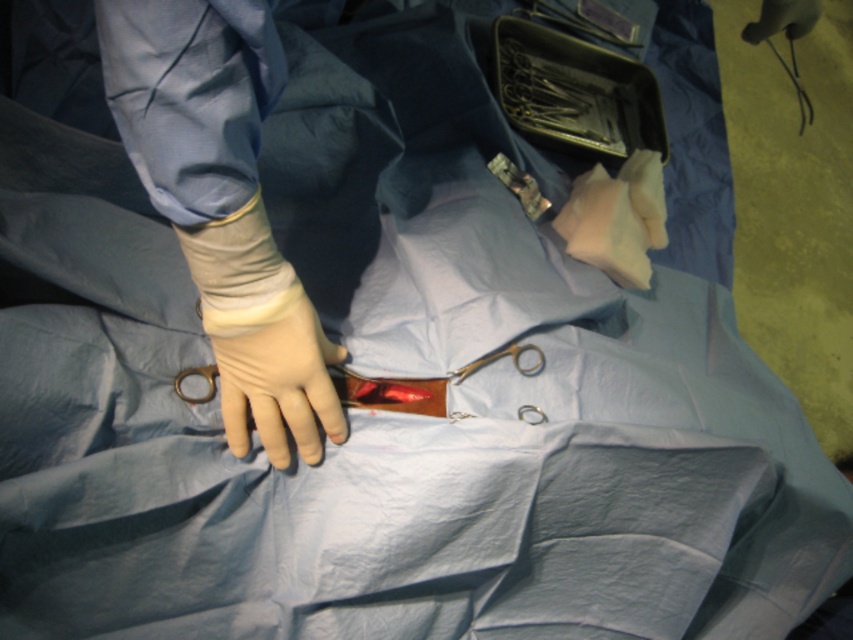
You are a medical student observing a surgery. The surgical instruments are placed at the point with coordinates (575,93). If you need to locate the instruments quickly during the procedure, which direction should you look relative to the central incision?

The point (575,93) corresponds to the metallic silver surgical instruments at upper right, so you should look towards the upper right direction relative to the central incision to locate them.

From the picture: You are a surgical assistant needing to reach the metallic silver surgical instruments at upper right from your current position near the beige rubber glove at left. Can you comfortably stretch your arm to reach them without moving your torso? Please consider the distance provided in the scene.

The distance between the beige rubber glove at left and the metallic silver surgical instruments at upper right is 75.72 centimeters. Given that the average human arm length is around 70 centimeters, stretching might be required, but it could be possible depending on individual flexibility. However, in a surgical setting, reaching such a distance without moving the torso might be challenging and not advisable for precision. It is recommended to adjust positioning or ask for assistance.

You are a surgical assistant observing the procedure. You notice two rubber gloves in the image. Which one is positioned higher up, the beige rubber glove at left or the rubber glove at center?

The beige rubber glove at left is positioned higher up than the rubber glove at center.